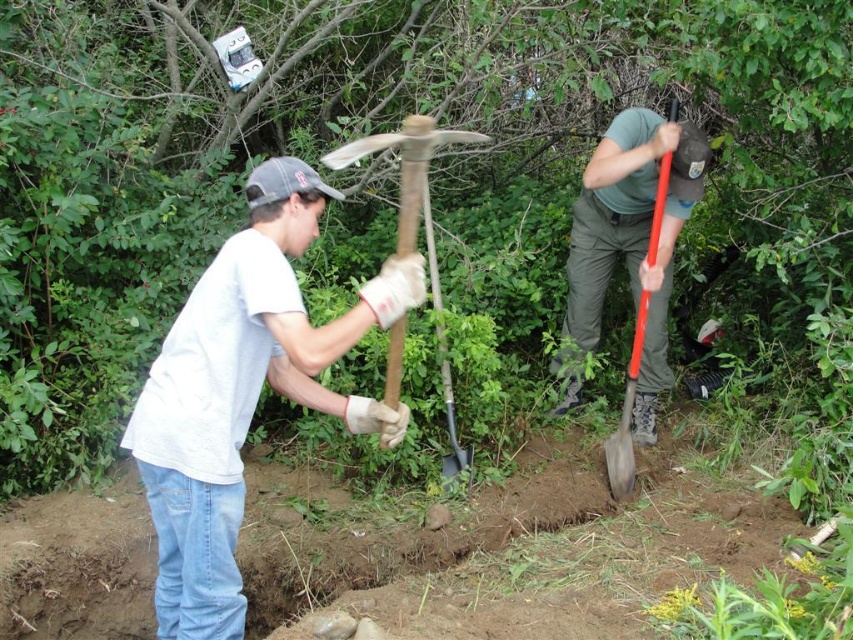
You are a gardener trying to choose between the green matte shovel at center and the wooden pickaxe at center for a task that requires a wider tool. Based on the scene, which tool should you select?

The green matte shovel at center has a greater width than the wooden pickaxe at center, so you should choose the green matte shovel at center for the task requiring a wider tool.

You are standing at the origin point in the image. There is a white matte shirt at center located at coordinate point (242,403). If you move 0.1 units to the north, will you be closer to the white matte shirt at center?

The point (242,403) is where the white matte shirt at center is located. Moving north increases the y coordinate. Since the original y coordinate is 0.285, moving north to 0.385 would take you away from the shirt, so you would be farther away.